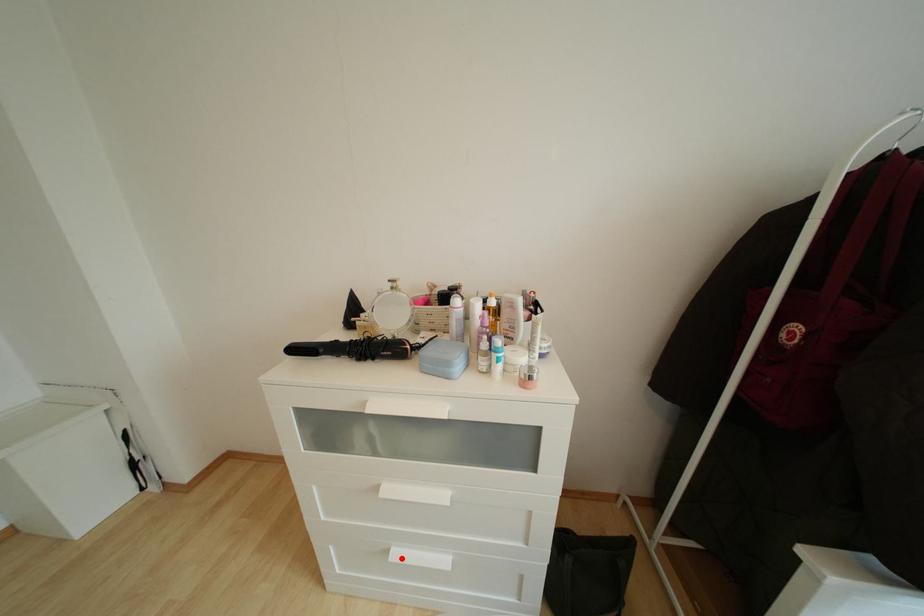
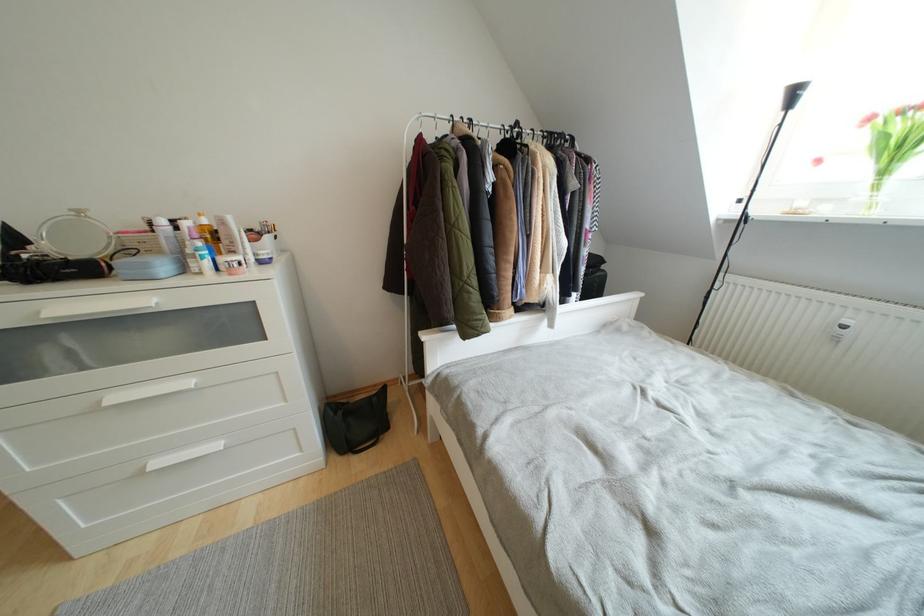
Where in the second image is the point corresponding to the highlighted location from the first image?

(162, 467)